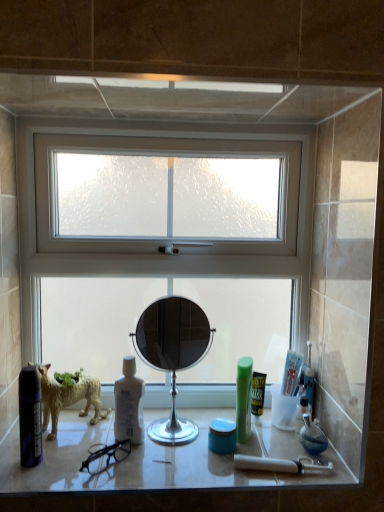
This screenshot has height=512, width=384. In order to click on vacant position to the left of blue matte jar at center, the second mouthwash positioned from the left in this screenshot , I will do `click(168, 452)`.